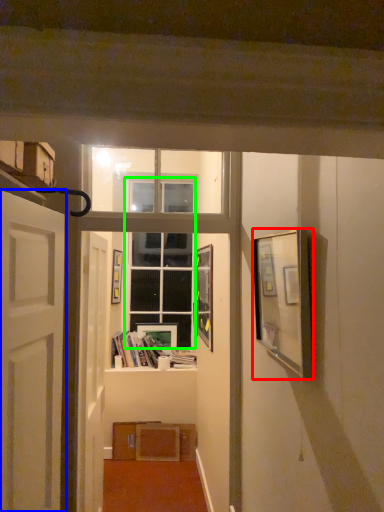
Question: Based on their relative distances, which object is nearer to picture frame (highlighted by a red box)? Choose from door (highlighted by a blue box) and glass door (highlighted by a green box).

Choices:
 (A) door
 (B) glass door

Answer: (A)